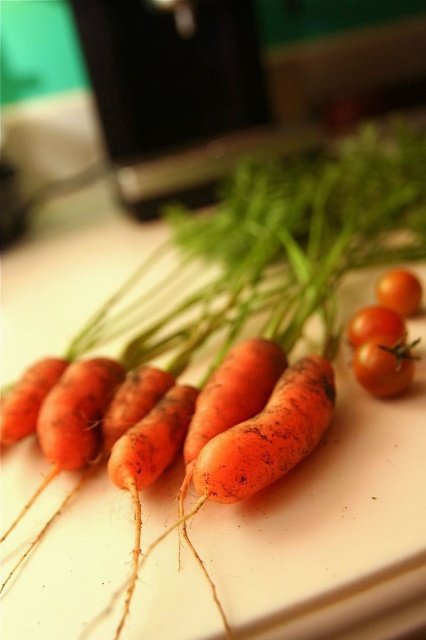
From the picture: Is glossy red tomato at lower right bigger than glossy orange tomato at center right?

Actually, glossy red tomato at lower right might be smaller than glossy orange tomato at center right.

Looking at this image, does glossy red tomato at lower right appear on the right side of glossy orange tomato at center right?

Incorrect, glossy red tomato at lower right is not on the right side of glossy orange tomato at center right.

Between point (365, 372) and point (414, 292), which one is positioned behind?

Point (414, 292)

The width and height of the screenshot is (426, 640). I want to click on glossy red tomato at lower right, so click(x=385, y=364).

Based on the photo, is orange rough carrot at center wider than orange matte carrot at center?

Yes.

Who is more distant from viewer, (331, 404) or (20, 413)?

The point (20, 413) is more distant.

Between point (328, 371) and point (20, 426), which one is positioned in front?

Positioned in front is point (328, 371).

Locate an element on the screen. The width and height of the screenshot is (426, 640). orange rough carrot at center is located at coordinates (268, 435).

Does orange matte carrot at center appear over glossy orange tomato at center right?

Incorrect, orange matte carrot at center is not positioned above glossy orange tomato at center right.

Between point (0, 445) and point (385, 289), which one is positioned behind?

Positioned behind is point (385, 289).

At what (x,y) coordinates should I click in order to perform the action: click on orange matte carrot at center. Please return your answer as a coordinate pair (x, y). Looking at the image, I should click on (26, 397).